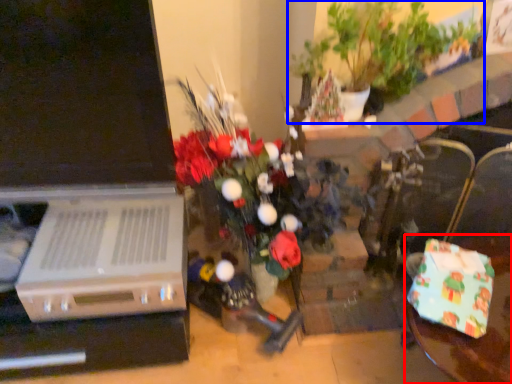
Question: Among these objects, which one is nearest to the camera, table (highlighted by a red box) or houseplant (highlighted by a blue box)?

Choices:
 (A) table
 (B) houseplant

Answer: (A)